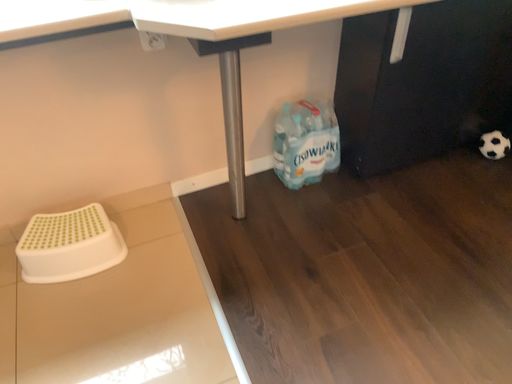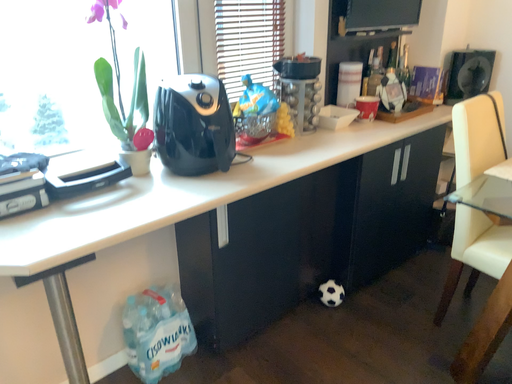
Question: How did the camera likely rotate when shooting the video?

Choices:
 (A) rotated upward
 (B) rotated downward

Answer: (A)